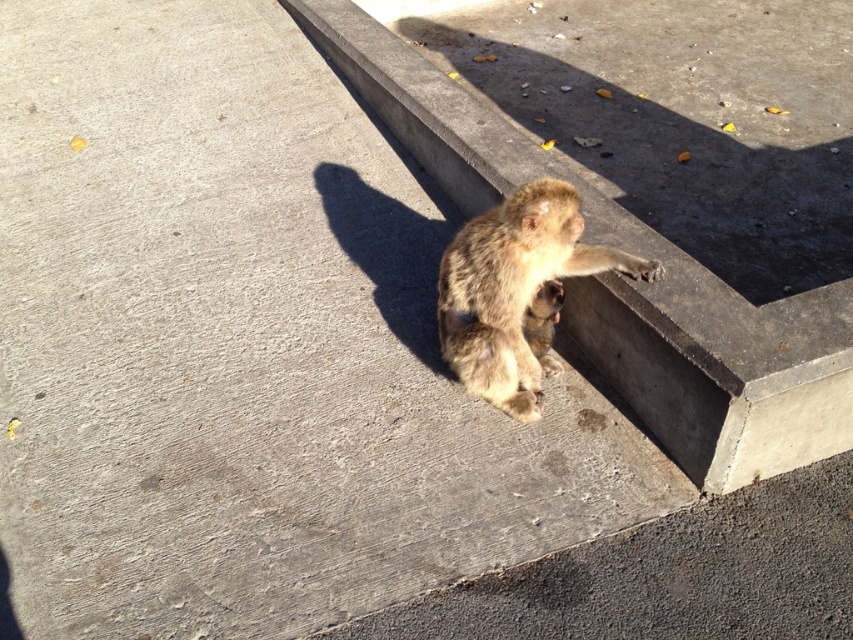
Question: Does concrete ledge at center lie in front of fuzzy fur monkey at upper right?

Choices:
 (A) no
 (B) yes

Answer: (B)

Question: Which object is closer to the camera taking this photo?

Choices:
 (A) concrete ledge at center
 (B) fuzzy fur monkey at upper right

Answer: (A)

Question: In this image, where is concrete ledge at center located relative to fuzzy fur monkey at upper right?

Choices:
 (A) above
 (B) below

Answer: (A)

Question: Which point appears closest to the camera in this image?

Choices:
 (A) (573, 269)
 (B) (785, 339)

Answer: (B)

Question: Where is concrete ledge at center located in relation to fuzzy fur monkey at upper right in the image?

Choices:
 (A) below
 (B) above

Answer: (B)